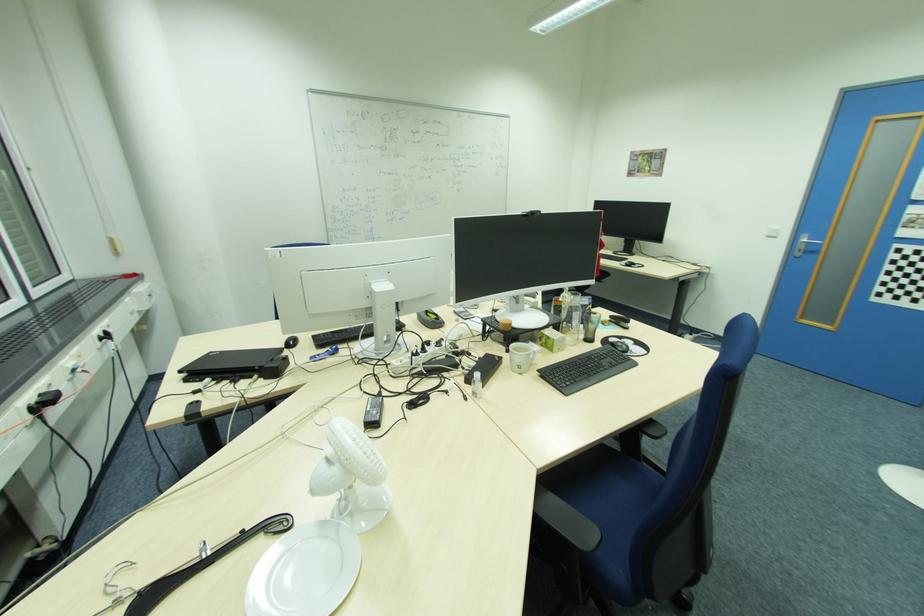
This screenshot has height=616, width=924. Identify the location of silver door handle. (806, 243).